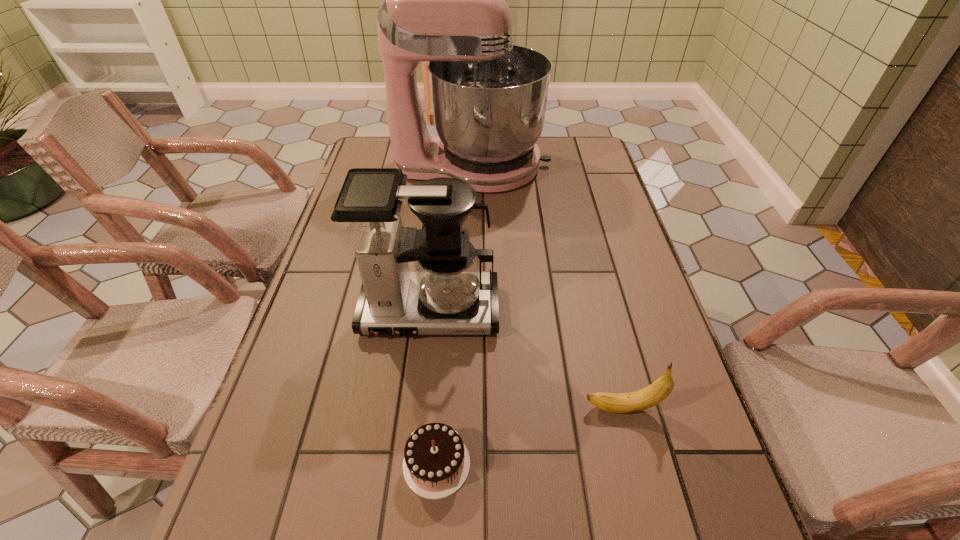
At what (x,y) coordinates should I click in order to perform the action: click on vacant space located at the start of the peel on the banana. Please return your answer as a coordinate pair (x, y). Image resolution: width=960 pixels, height=540 pixels. Looking at the image, I should click on (371, 408).

You are a GUI agent. You are given a task and a screenshot of the screen. Output one action in this format:
    pyautogui.click(x=<x>, y=<y>)
    Task: Click on the free space located at the start of the peel on the banana
    
    Given the screenshot: What is the action you would take?
    pyautogui.click(x=493, y=408)

Locate an element on the screen. vacant space situated 0.070m at the start of the peel on the banana is located at coordinates (547, 408).

Where is `free location located 0.170m on the left of the shortest object`? The image size is (960, 540). free location located 0.170m on the left of the shortest object is located at coordinates (303, 464).

Find the location of a particular element. This screenshot has width=960, height=540. object that is at the far edge is located at coordinates (443, 0).

Identify the location of mixer present at the left edge. The width and height of the screenshot is (960, 540). (443, 0).

Find the location of a particular element. coffee maker situated at the left edge is located at coordinates (447, 294).

At what (x,y) coordinates should I click in order to perform the action: click on object present at the right edge. Please return your answer as a coordinate pair (x, y). This screenshot has height=540, width=960. Looking at the image, I should click on pos(643,399).

At what (x,y) coordinates should I click in order to perform the action: click on object that is at the far left corner. Please return your answer as a coordinate pair (x, y). Looking at the image, I should click on (443, 0).

You are a GUI agent. You are given a task and a screenshot of the screen. Output one action in this format:
    pyautogui.click(x=<x>, y=<y>)
    Task: Click on the free space at the far edge
    This screenshot has height=540, width=960.
    Given the screenshot: What is the action you would take?
    click(546, 153)